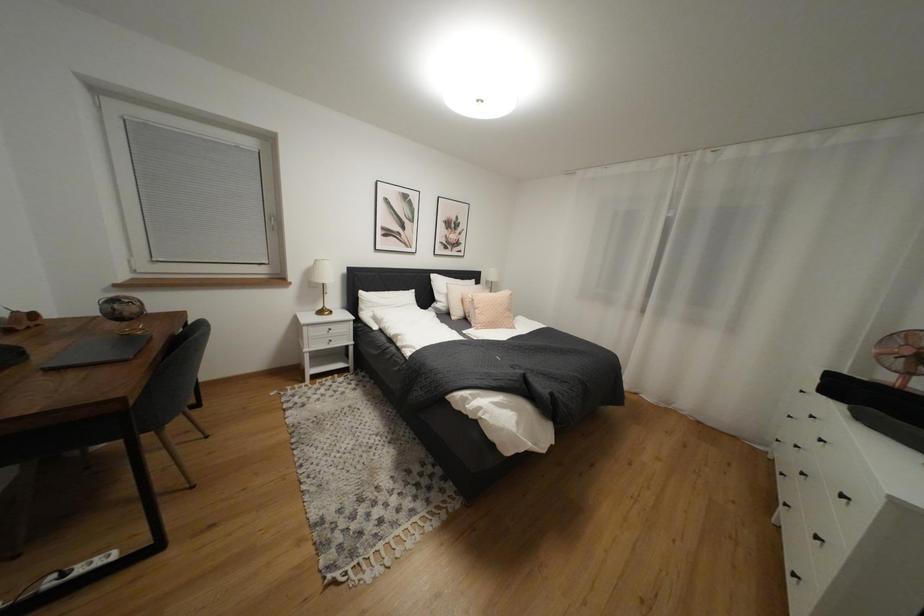
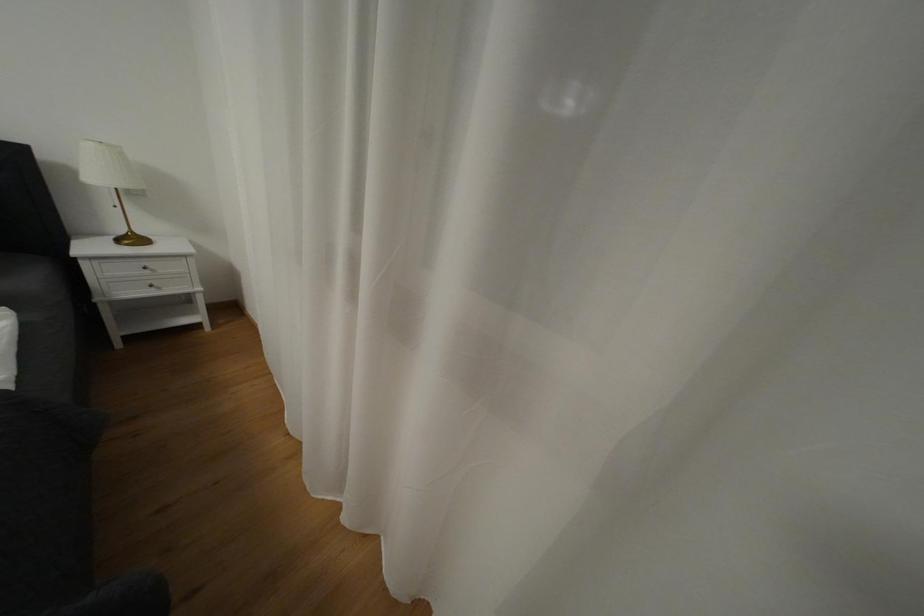
The images are taken continuously from a first-person perspective. In which direction are you moving?

The cameraman moved toward right, forward.